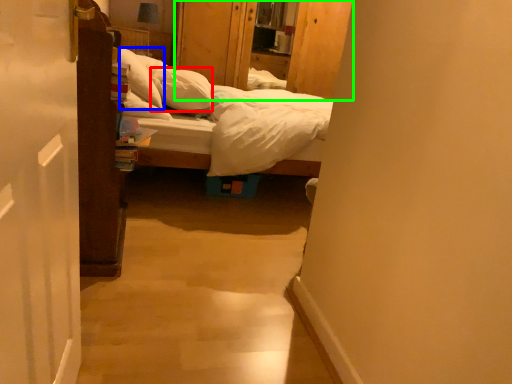
Question: Which object is the closest to the pillow (highlighted by a red box)? Choose among these: pillow (highlighted by a blue box) or dresser (highlighted by a green box).

Choices:
 (A) pillow
 (B) dresser

Answer: (A)